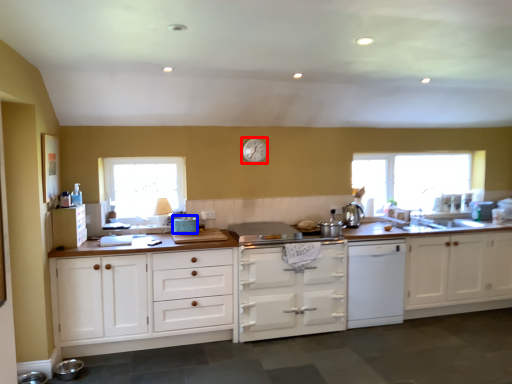
Question: Which of the following is the closest to the observer, clock (highlighted by a red box) or appliance (highlighted by a blue box)?

Choices:
 (A) clock
 (B) appliance

Answer: (B)